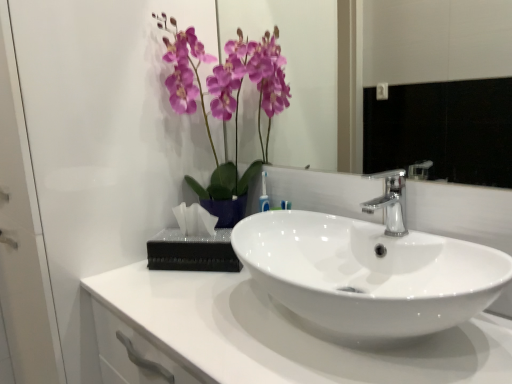
Where is `free region on the left part of translucent plastic tissue at center`? This screenshot has height=384, width=512. free region on the left part of translucent plastic tissue at center is located at coordinates (125, 274).